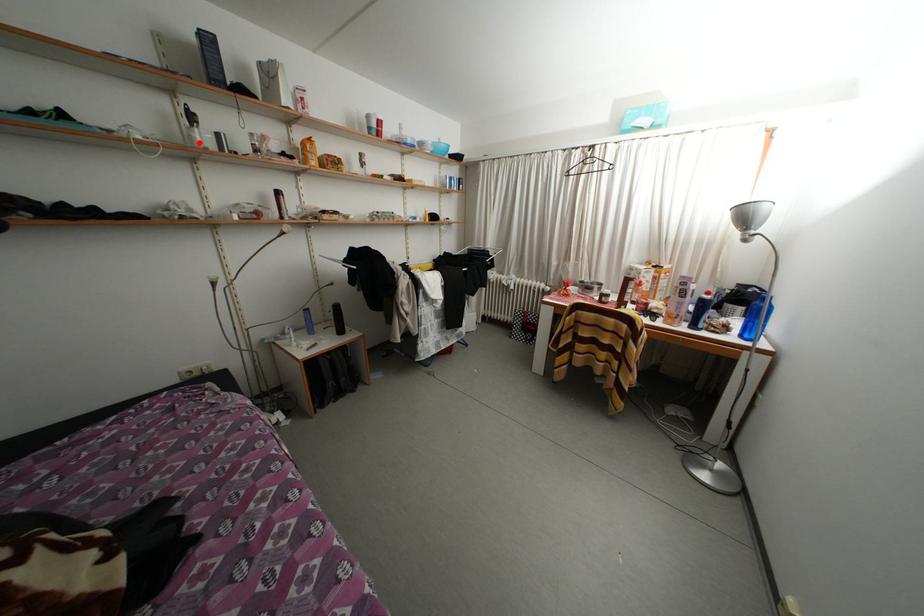
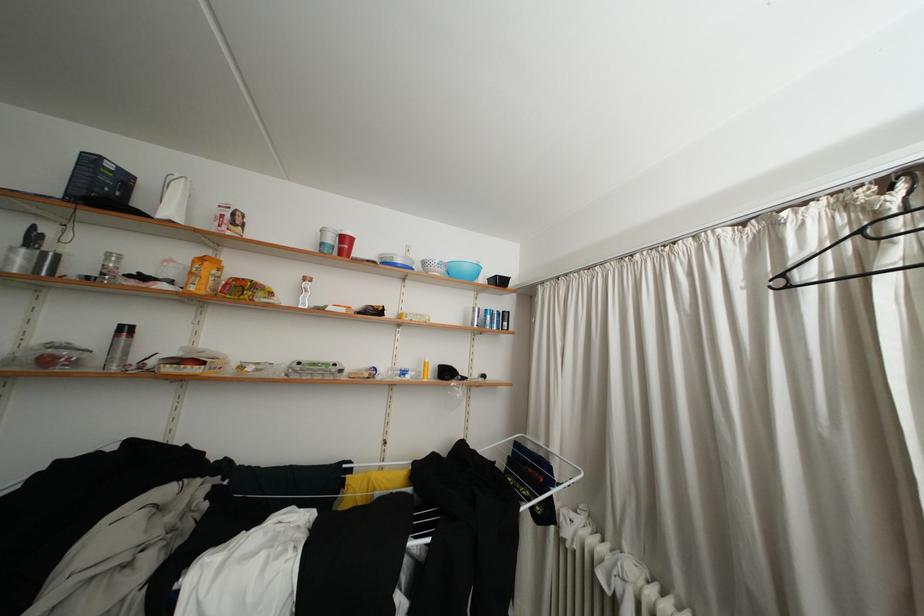
Question: I am providing you with two images of the same scene from different viewpoints. A red point is marked on the first image. At the location where the point appears in image 1, is it still visible in image 2?

Choices:
 (A) Yes
 (B) No

Answer: (A)